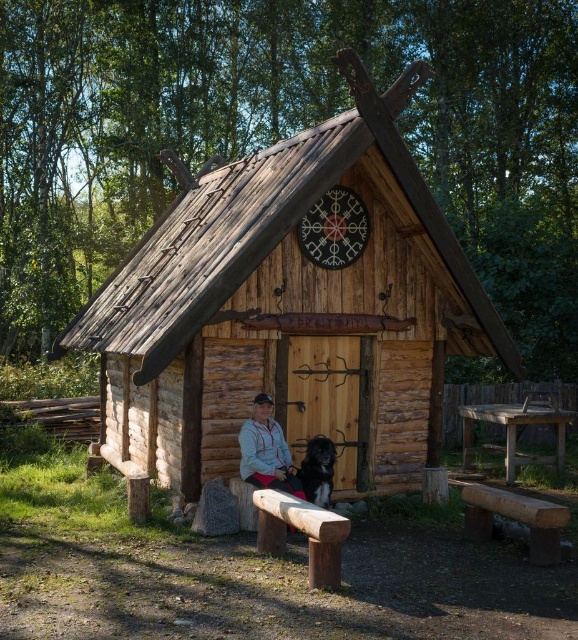
Does wooden log cabin at center appear over smooth wooden bench at lower right?

Yes.

Consider the image. Does wooden log cabin at center have a larger size compared to smooth wooden bench at lower right?

Actually, wooden log cabin at center might be smaller than smooth wooden bench at lower right.

Does point (346, 163) come closer to viewer compared to point (539, 540)?

No, (346, 163) is further to viewer.

Identify the location of wooden log cabin at center. Image resolution: width=578 pixels, height=640 pixels. (291, 305).

In the scene shown: How much distance is there between wooden log cabin at center and light gray fleece jacket at center?

A distance of 7.46 meters exists between wooden log cabin at center and light gray fleece jacket at center.

Does wooden log cabin at center appear under light gray fleece jacket at center?

No.

Identify the location of wooden log cabin at center. (291, 305).

Can you confirm if wooden picnic table at right is smaller than light gray fleece jacket at center?

Actually, wooden picnic table at right might be larger than light gray fleece jacket at center.

Which is in front, point (560, 410) or point (272, 445)?

Point (272, 445) is more forward.

Where is `wooden picnic table at right`? wooden picnic table at right is located at coordinates (516, 429).